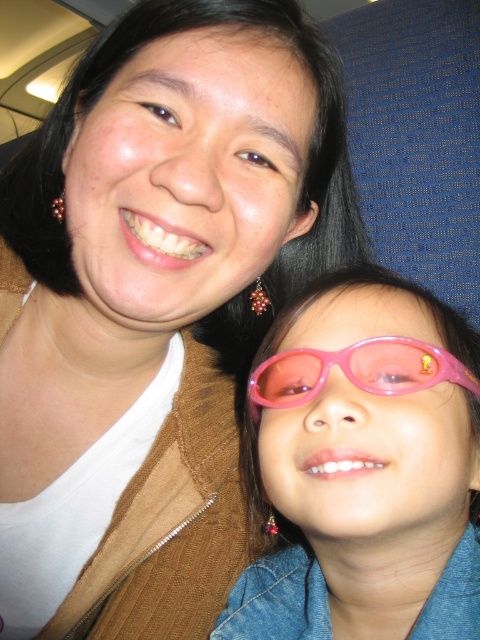
Is pink plastic sunglasses at lower right below pink translucent goggles at lower center?

Yes, pink plastic sunglasses at lower right is below pink translucent goggles at lower center.

Is point (420, 394) positioned behind point (343, 368)?

No, it is not.

Does point (300, 314) come closer to viewer compared to point (381, 349)?

No, (300, 314) is behind (381, 349).

You are a GUI agent. You are given a task and a screenshot of the screen. Output one action in this format:
    pyautogui.click(x=<x>, y=<y>)
    Task: Click on the pink plastic sunglasses at lower right
    Image resolution: width=480 pixels, height=640 pixels.
    Given the screenshot: What is the action you would take?
    pyautogui.click(x=365, y=467)